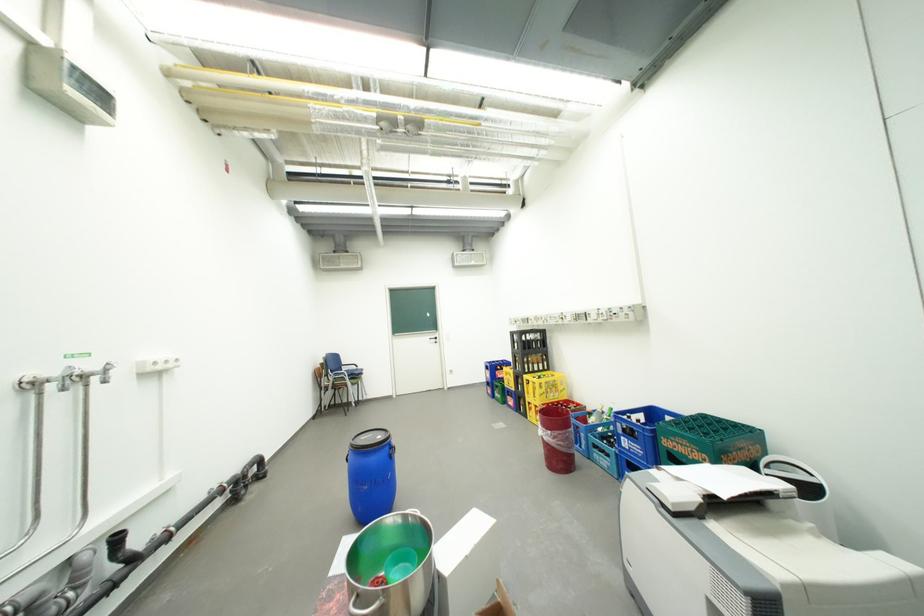
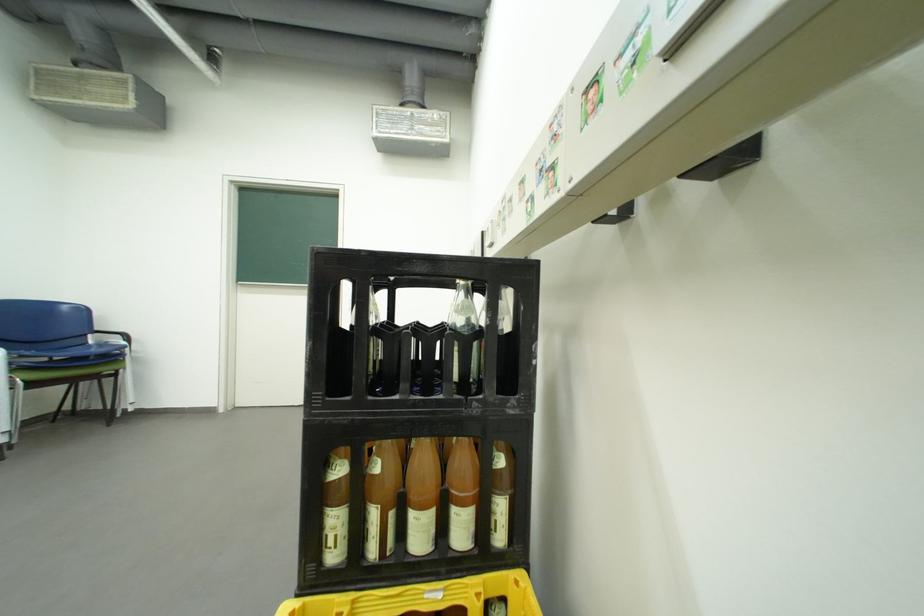
In a continuous first-person perspective shot, in which direction is the camera moving?

The movement direction of the cameraman is right, forward.